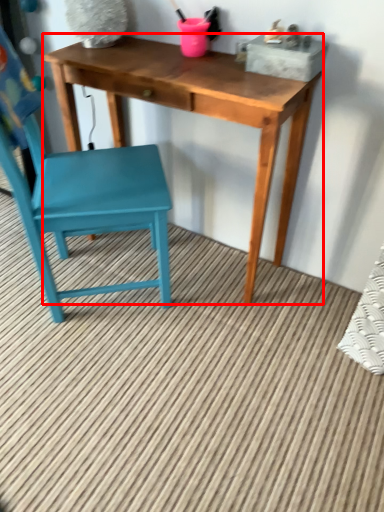
Question: From the image's perspective, where is table (annotated by the red box) located relative to chair?

Choices:
 (A) above
 (B) below

Answer: (A)